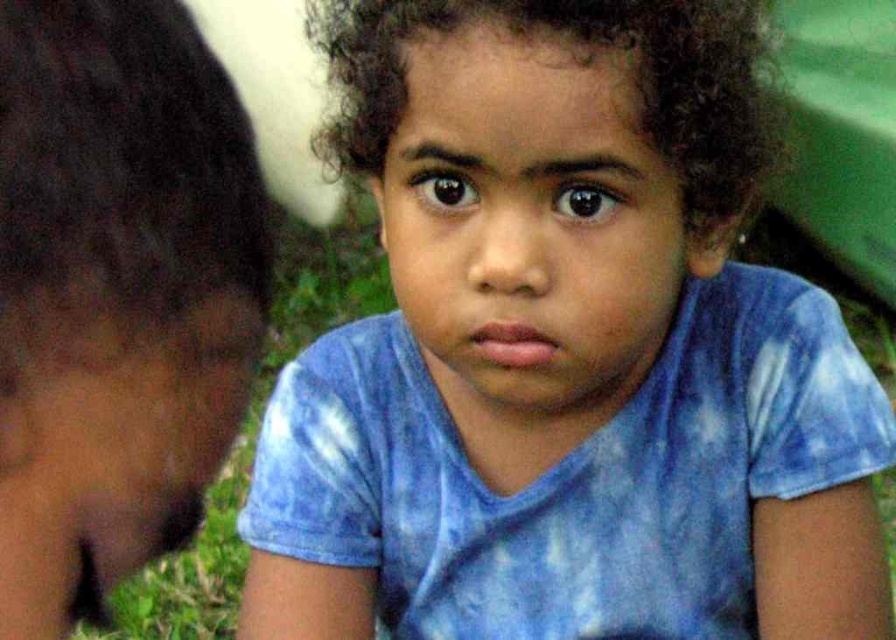
Question: Is blue tie-dye shirt at center closer to camera compared to green grass at lower left?

Choices:
 (A) no
 (B) yes

Answer: (B)

Question: Which point appears farthest from the camera in this image?

Choices:
 (A) (790, 632)
 (B) (7, 433)

Answer: (A)

Question: Is the position of blue tie-dye shirt at center more distant than that of green grass at lower left?

Choices:
 (A) no
 (B) yes

Answer: (A)

Question: Which object appears farthest from the camera in this image?

Choices:
 (A) brown hair at left
 (B) blue tie-dye shirt at center
 (C) green grass at lower left

Answer: (C)

Question: Can you confirm if brown hair at left is positioned above green grass at lower left?

Choices:
 (A) no
 (B) yes

Answer: (B)

Question: Which object is closer to the camera taking this photo?

Choices:
 (A) blue tie-dye shirt at center
 (B) green grass at lower left
 (C) brown hair at left

Answer: (C)